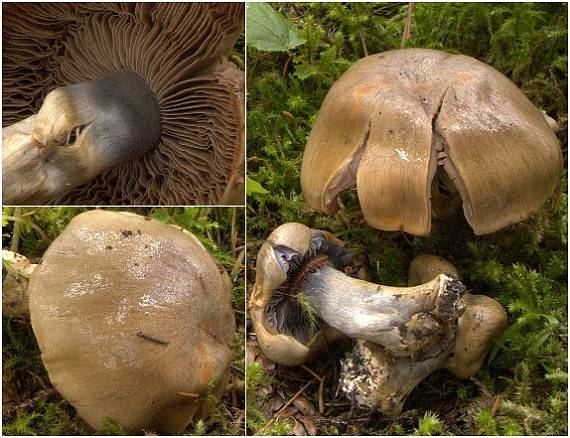
At what (x,y) coordinates should I click in order to perform the action: click on light reflections. Please return your answer as a coordinate pair (x, y). The height and width of the screenshot is (438, 570). Looking at the image, I should click on (137, 275), (148, 305), (81, 283), (125, 312).